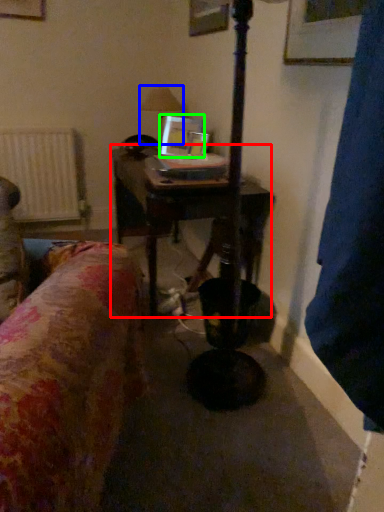
Question: Estimate the real-world distances between objects in this image. Which object is farther from table (highlighted by a red box), table lamp (highlighted by a blue box) or picture frame (highlighted by a green box)?

Choices:
 (A) table lamp
 (B) picture frame

Answer: (A)